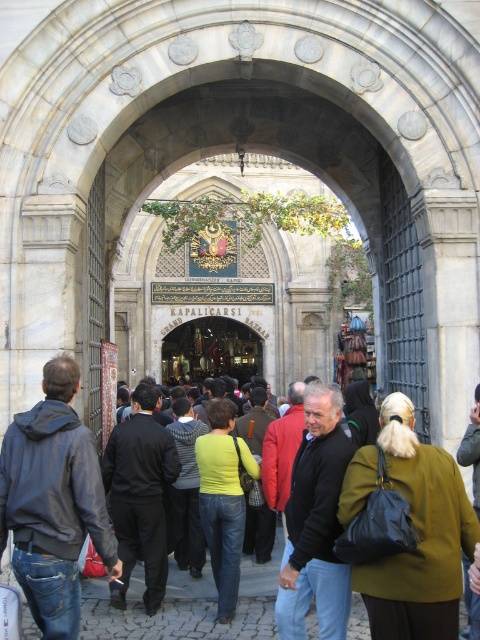
Is olive-green fabric coat at center smaller than green matte shirt at center?

No.

Is point (435, 509) positioned in front of point (192, 458)?

Yes, point (435, 509) is closer to viewer.

Locate an element on the screen. olive-green fabric coat at center is located at coordinates (420, 536).

Can you confirm if black cotton pants at center is shorter than green wool coat at center?

Yes.

Which is above, black cotton pants at center or green wool coat at center?

Positioned higher is green wool coat at center.

Is point (156, 564) less distant than point (462, 444)?

No, (156, 564) is behind (462, 444).

Where is `black cotton pants at center`? Image resolution: width=480 pixels, height=640 pixels. black cotton pants at center is located at coordinates (140, 496).

Looking at this image, who is shorter, denim jacket at center or matte green sweater at center?

Standing shorter between the two is matte green sweater at center.

Which is in front, point (23, 492) or point (222, 531)?

Positioned in front is point (23, 492).

Which is in front, point (75, 413) or point (217, 573)?

Point (75, 413) is more forward.

This screenshot has width=480, height=640. I want to click on denim jacket at center, so click(52, 500).